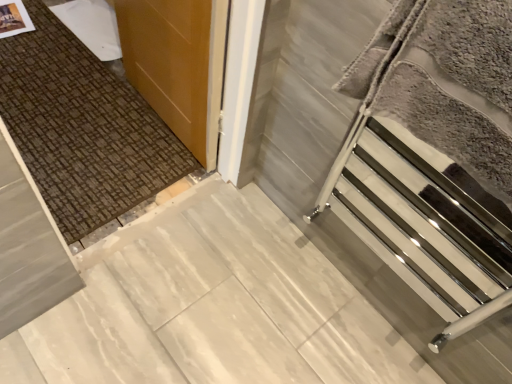
Where is `free spot below polished chrome towel rack at right (from a real-world perspective)`? The width and height of the screenshot is (512, 384). free spot below polished chrome towel rack at right (from a real-world perspective) is located at coordinates (350, 309).